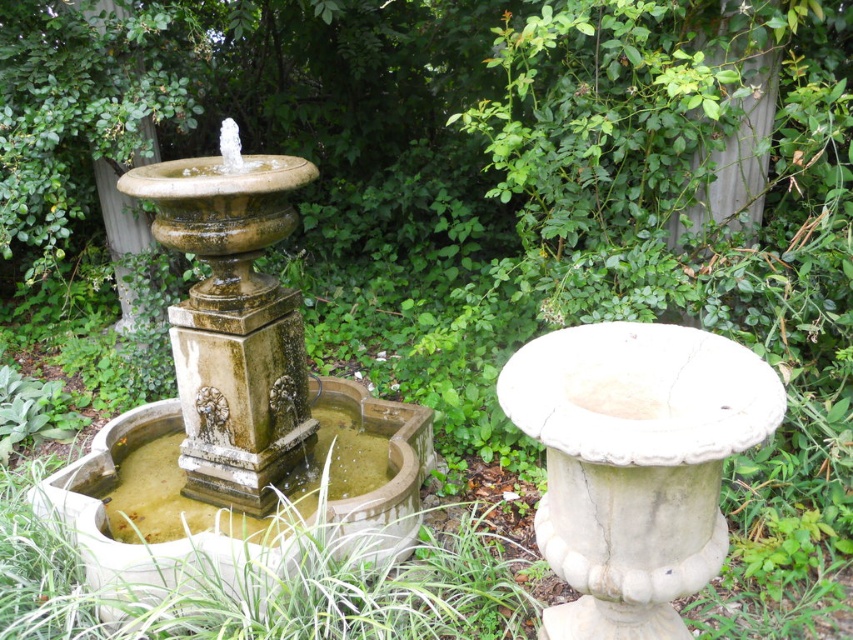
From the picture: Is speckled stone fountain at center shorter than white marble urn at center?

No.

Can you confirm if speckled stone fountain at center is positioned above white marble urn at center?

Indeed, speckled stone fountain at center is positioned over white marble urn at center.

Image resolution: width=853 pixels, height=640 pixels. Identify the location of speckled stone fountain at center. (236, 413).

Which of these two, speckled stone fountain at center or greenish stone fountain at center, stands taller?

speckled stone fountain at center is taller.

Is point (172, 320) positioned before point (323, 515)?

That is False.

At what (x,y) coordinates should I click in order to perform the action: click on speckled stone fountain at center. Please return your answer as a coordinate pair (x, y). Looking at the image, I should click on (236, 413).

Where is `white marble urn at center`? white marble urn at center is located at coordinates (634, 464).

Is white marble urn at center closer to camera compared to greenish stone fountain at center?

Yes, white marble urn at center is closer to the viewer.

Who is more forward, (x=573, y=488) or (x=131, y=429)?

Point (x=573, y=488) is in front.

Locate an element on the screen. white marble urn at center is located at coordinates (634, 464).